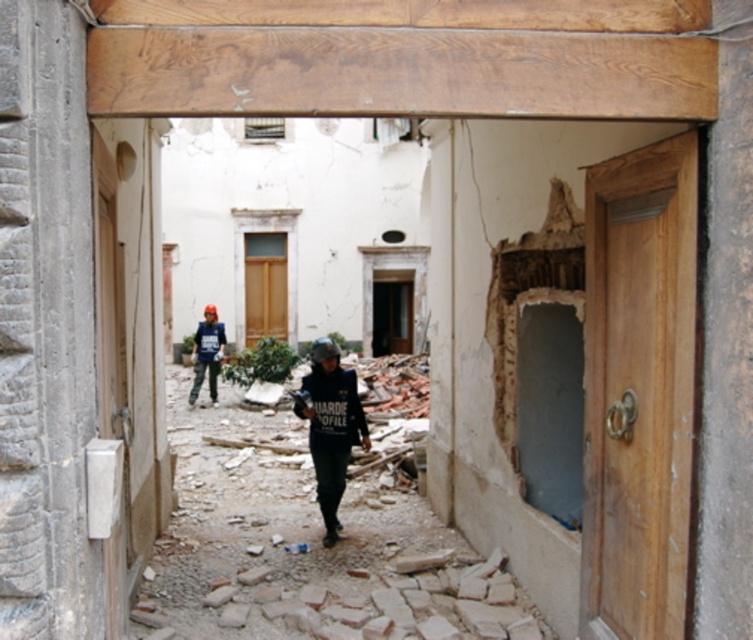
Between point (346, 387) and point (206, 323), which one is positioned behind?

Positioned behind is point (206, 323).

The width and height of the screenshot is (753, 640). What do you see at coordinates (331, 428) in the screenshot? I see `dark blue uniform at center` at bounding box center [331, 428].

Locate an element on the screen. dark blue uniform at center is located at coordinates (331, 428).